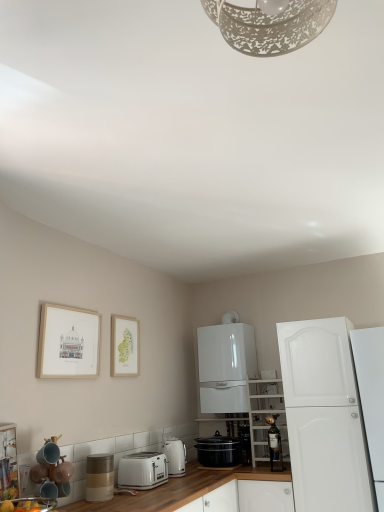
Question: From a real-world perspective, is white matte cabinet at right, the third cabinetry viewed from the left, above or below white glossy boiler at center, positioned as the 3th cabinetry in right-to-left order?

Choices:
 (A) above
 (B) below

Answer: (B)

Question: In terms of height, does white matte cabinet at right, the third cabinetry viewed from the left, look taller or shorter compared to white glossy boiler at center, the 1th cabinetry from the left?

Choices:
 (A) short
 (B) tall

Answer: (B)

Question: Which is nearer to the white matte shelving unit at center-right, the 2th cabinetry viewed from the right?

Choices:
 (A) matte white toaster at lower left, positioned as the 2th appliance in left-to-right order
 (B) black matte slow cooker at lower center, the second kitchen appliance when ordered from left to right
 (C) white plastic toaster at lower center
 (D) watercolor paper picture frame at upper center, which is the second picture frame in front-to-back order
 (E) matte white picture frame at upper left, which appears as the 1th picture frame when viewed from the front

Answer: (B)

Question: Based on their relative distances, which object is farther from the watercolor paper picture frame at upper center, the 1th picture frame when ordered from right to left?

Choices:
 (A) black glossy slow cooker at center, arranged as the 1th appliance when viewed from the back
 (B) matte white toaster at lower left, positioned as the 4th appliance in right-to-left order
 (C) matte beige container at lower left, acting as the 3th appliance starting from the back
 (D) white matte cabinet at right, the third cabinetry viewed from the left
 (E) matte ceramic mugs at lower left, which ranks as the fourth appliance in back-to-front order

Answer: (D)